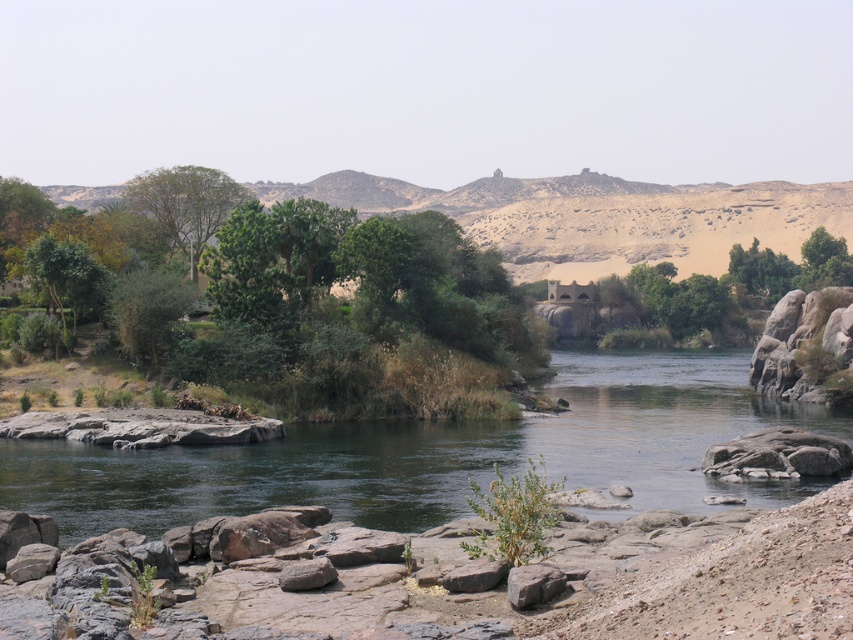
You are a hiker standing at the center of the image. You want to reach the green leafy tree at left. In which general direction should you head?

The green leafy tree at left is located at point (67, 275), so you should head towards the left direction to reach it.